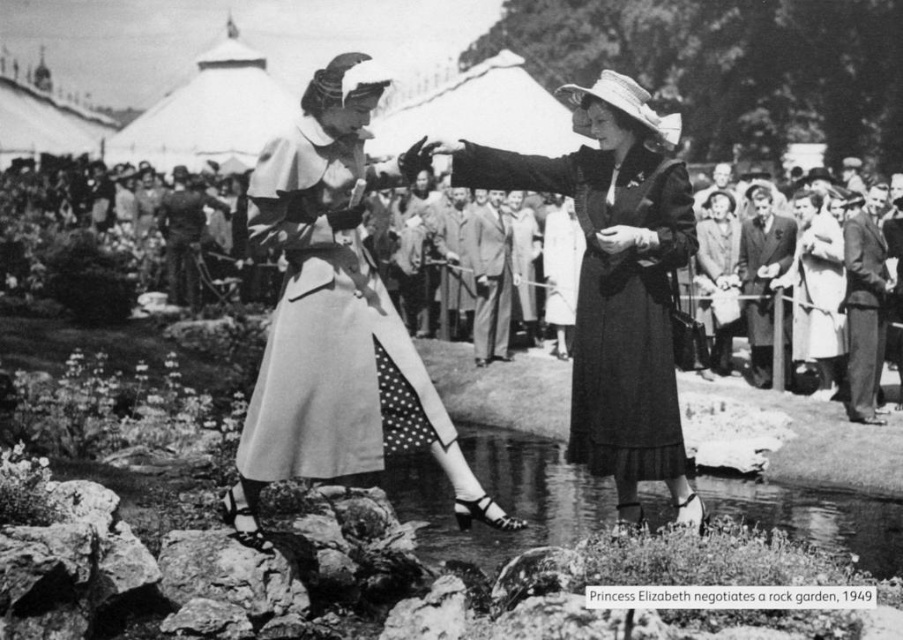
Is point (360, 468) closer to viewer compared to point (821, 273)?

That is True.

Is light beige fabric dress at center smaller than light beige fabric dress at right?

Indeed, light beige fabric dress at center has a smaller size compared to light beige fabric dress at right.

Where is `light beige fabric dress at center`? light beige fabric dress at center is located at coordinates point(328,324).

Does clear water at pond center appear on the right side of smooth fabric suits at center?

Indeed, clear water at pond center is positioned on the right side of smooth fabric suits at center.

Is point (473, 531) closer to viewer compared to point (26, 294)?

Yes, it is in front of point (26, 294).

Where is `clear water at pond center`? This screenshot has height=640, width=903. clear water at pond center is located at coordinates (499, 496).

I want to click on clear water at pond center, so click(499, 496).

Does clear water at pond center have a greater width compared to light beige fabric dress at right?

Yes, clear water at pond center is wider than light beige fabric dress at right.

Is clear water at pond center positioned before light beige fabric dress at right?

Yes, it is.

Where is `clear water at pond center`? clear water at pond center is located at coordinates [499, 496].